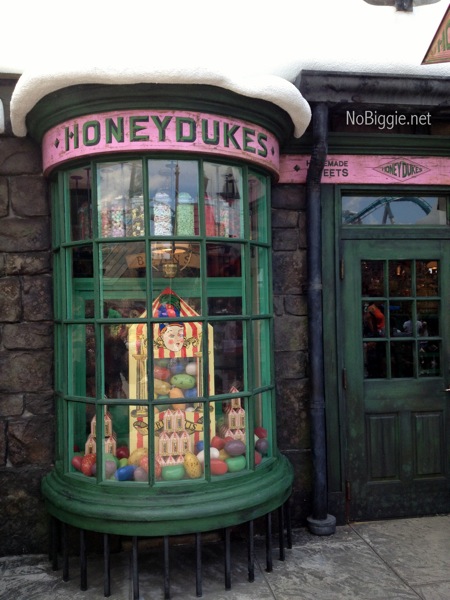
The image size is (450, 600). Find the location of `window display with toy eggs`. window display with toy eggs is located at coordinates (173, 372).